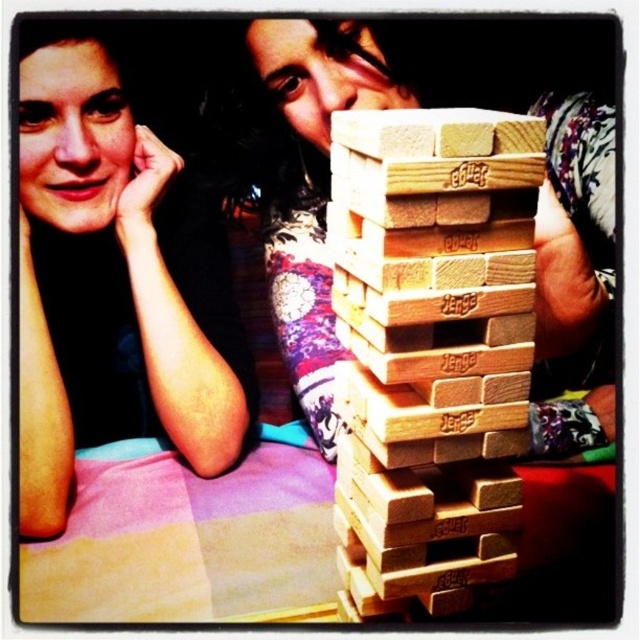
Question: Does natural wood jenga blocks at center appear on the right side of wooden block at center?

Choices:
 (A) yes
 (B) no

Answer: (A)

Question: Does wooden blocks at center have a lesser width compared to wooden block at center?

Choices:
 (A) no
 (B) yes

Answer: (A)

Question: Is natural wood jenga blocks at center positioned in front of matte black hair at upper left?

Choices:
 (A) no
 (B) yes

Answer: (B)

Question: Which point is farther to the camera?

Choices:
 (A) (244, 68)
 (B) (141, 360)
 (C) (420, 131)
 (D) (529, 204)

Answer: (B)

Question: Which of these objects is positioned closest to the matte black hair at upper left?

Choices:
 (A) wooden block at center
 (B) wooden blocks at center
 (C) natural wood jenga blocks at center

Answer: (B)

Question: Estimate the real-world distances between objects in this image. Which object is closer to the wooden blocks at center?

Choices:
 (A) natural wood jenga blocks at center
 (B) matte black hair at upper left
 (C) wooden block at center

Answer: (B)